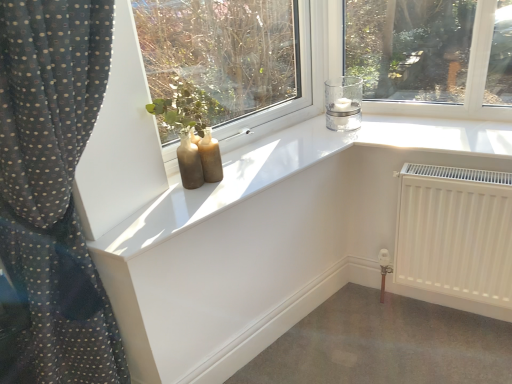
Question: Is clear glass candle at upper right bigger than matte glass bottles at center?

Choices:
 (A) no
 (B) yes

Answer: (A)

Question: Is clear glass candle at upper right facing towards matte glass bottles at center?

Choices:
 (A) yes
 (B) no

Answer: (B)

Question: Is clear glass candle at upper right smaller than matte glass bottles at center?

Choices:
 (A) no
 (B) yes

Answer: (B)

Question: Considering the relative sizes of clear glass candle at upper right and matte glass bottles at center in the image provided, is clear glass candle at upper right shorter than matte glass bottles at center?

Choices:
 (A) no
 (B) yes

Answer: (B)

Question: Does clear glass candle at upper right have a lesser width compared to matte glass bottles at center?

Choices:
 (A) yes
 (B) no

Answer: (B)

Question: Is the depth of clear glass candle at upper right greater than that of matte glass bottles at center?

Choices:
 (A) no
 (B) yes

Answer: (B)

Question: Does white matte radiator at lower right have a greater height compared to clear glass candle at upper right?

Choices:
 (A) no
 (B) yes

Answer: (B)

Question: Is white matte radiator at lower right next to clear glass candle at upper right?

Choices:
 (A) no
 (B) yes

Answer: (A)

Question: Can you confirm if white matte radiator at lower right is smaller than clear glass candle at upper right?

Choices:
 (A) yes
 (B) no

Answer: (B)

Question: Can you confirm if white matte radiator at lower right is thinner than clear glass candle at upper right?

Choices:
 (A) no
 (B) yes

Answer: (B)

Question: Would you consider white matte radiator at lower right to be distant from clear glass candle at upper right?

Choices:
 (A) no
 (B) yes

Answer: (A)

Question: Does white matte radiator at lower right appear on the left side of clear glass candle at upper right?

Choices:
 (A) yes
 (B) no

Answer: (B)

Question: Is white matte radiator at lower right located within clear glass candle at upper right?

Choices:
 (A) yes
 (B) no

Answer: (B)